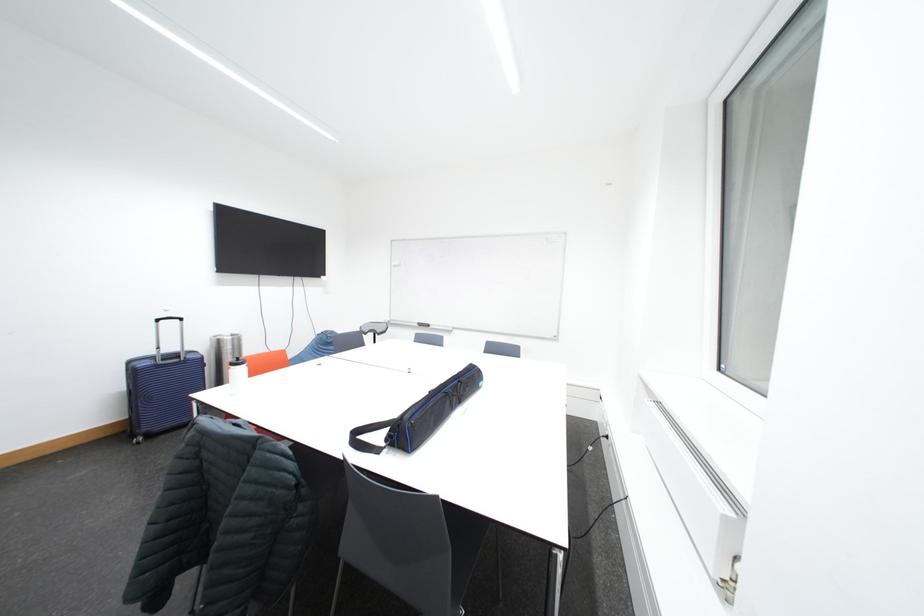
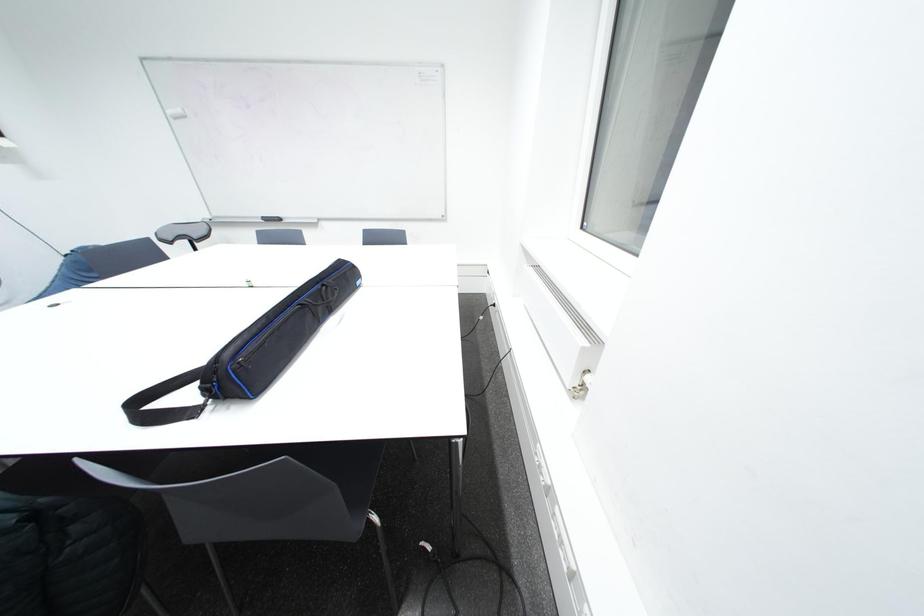
The first image is from the beginning of the video and the second image is from the end. How did the camera likely rotate when shooting the video?

The camera's rotation is toward right-down.